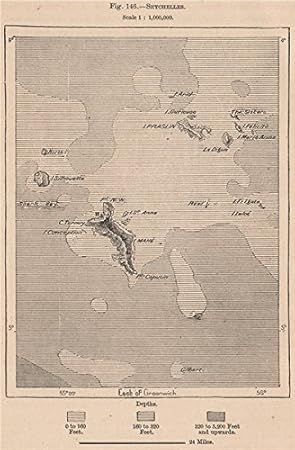
Where is `old map`? The width and height of the screenshot is (295, 450). old map is located at coordinates (164, 155).